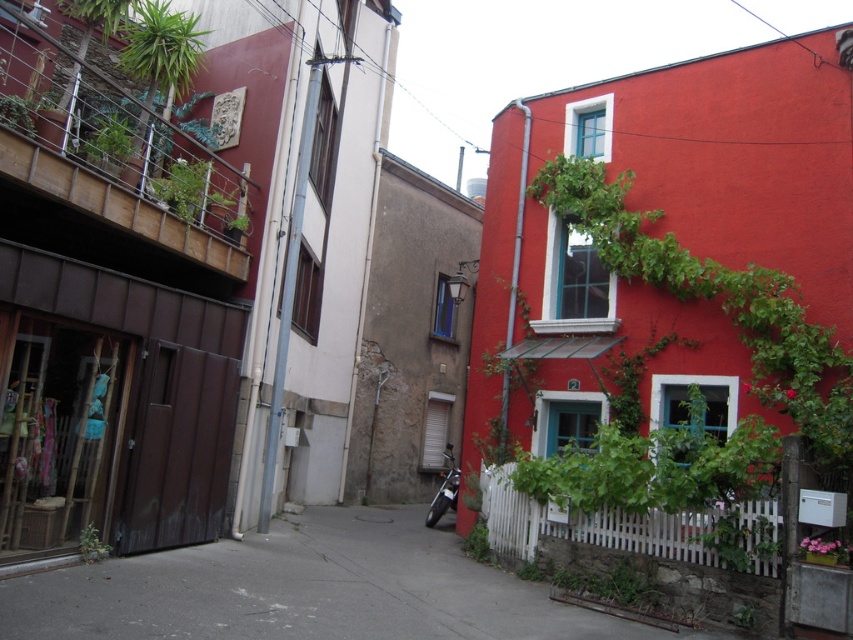
Question: Which point is farther from the camera taking this photo?

Choices:
 (A) (485, 536)
 (B) (167, 188)

Answer: (A)

Question: Is gray concrete pavement at lower center smaller than green leafy plant at lower left?

Choices:
 (A) yes
 (B) no

Answer: (B)

Question: Does gray concrete pavement at lower center appear over green leafy plant at lower left?

Choices:
 (A) yes
 (B) no

Answer: (B)

Question: Which of the following is the closest to the observer?

Choices:
 (A) green leafy plant at upper left
 (B) green leafy plant at lower center
 (C) green leafy plant at lower left
 (D) gray concrete pavement at lower center

Answer: (D)

Question: Where is gray concrete pavement at lower center located in relation to green leafy plant at upper left in the image?

Choices:
 (A) below
 (B) above

Answer: (A)

Question: Which of the following is the farthest from the observer?

Choices:
 (A) green leafy plant at lower center
 (B) green leafy plant at lower left

Answer: (A)